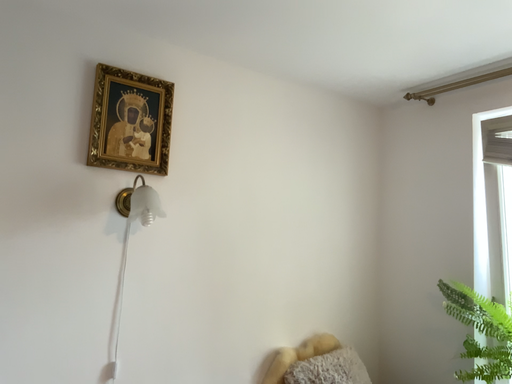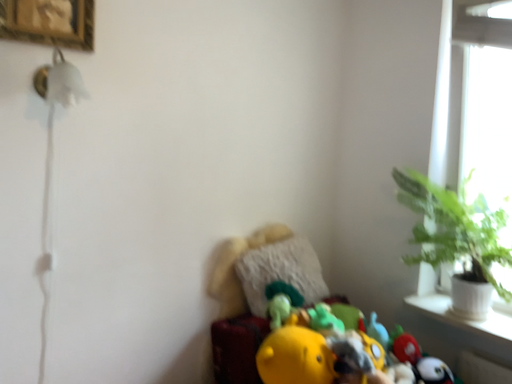
Question: Which way did the camera rotate in the video?

Choices:
 (A) rotated downward
 (B) rotated upward

Answer: (A)